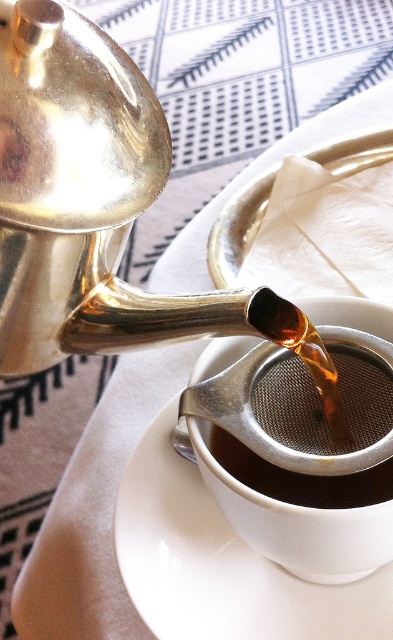
You are holding a small toy that is 2 inches wide. You want to place it on the point at coordinates point [203,508]. Can you do that?

The point point [203,508] is 26.25 inches away from viewer, so yes, the toy can be placed there since it is within reach.

You are setting up a tea service and need to place the shiny metallic coffee at center on the white ceramic saucer at center. Is the saucer positioned correctly to hold the coffee?

The white ceramic saucer at center is located below the shiny metallic coffee at center, so yes, the saucer is positioned correctly to hold the coffee.

You are setting up a tea service and have a white ceramic saucer at center and a shiny metallic coffee at center. Which object should you place the tea cup on to ensure it fits properly?

The white ceramic saucer at center is larger in size than the shiny metallic coffee at center, so you should place the tea cup on the white ceramic saucer at center to ensure it fits properly.